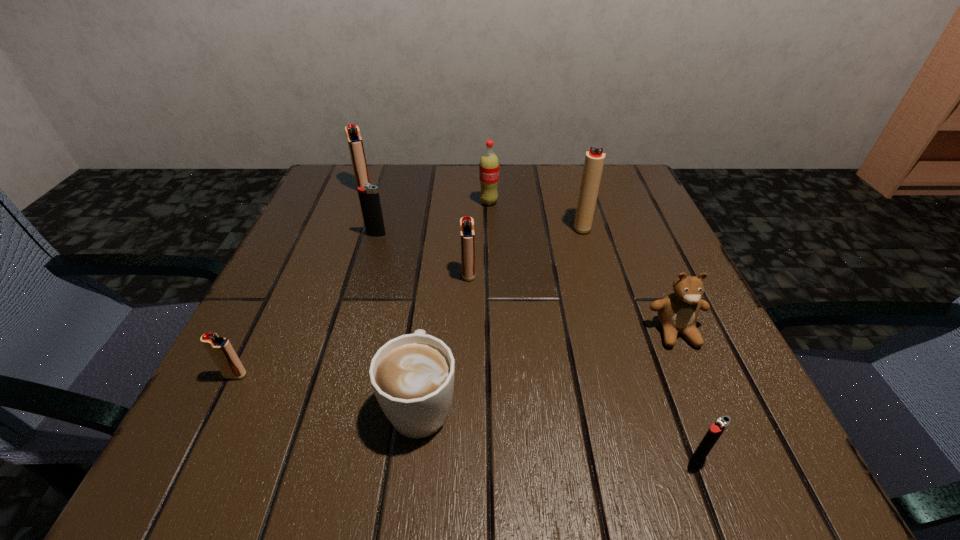
Identify the location of teddy bear at the right edge. The height and width of the screenshot is (540, 960). (678, 312).

Image resolution: width=960 pixels, height=540 pixels. In order to click on object positioned at the far left corner in this screenshot , I will do `click(355, 143)`.

The width and height of the screenshot is (960, 540). What are the coordinates of `object that is at the far right corner` in the screenshot? It's located at pos(594,160).

Locate an element on the screen. The image size is (960, 540). object that is at the near right corner is located at coordinates (x=715, y=431).

Image resolution: width=960 pixels, height=540 pixels. In the image, there is a desktop. Identify the location of vacant space at the far edge. (517, 218).

Where is `vacant space at the near edge of the desktop`? The height and width of the screenshot is (540, 960). vacant space at the near edge of the desktop is located at coordinates (592, 446).

Image resolution: width=960 pixels, height=540 pixels. Find the location of `free region at the left edge of the desktop`. free region at the left edge of the desktop is located at coordinates (255, 416).

I want to click on vacant area at the right edge of the desktop, so click(619, 246).

Image resolution: width=960 pixels, height=540 pixels. In order to click on vacant space at the far right corner of the desktop in this screenshot , I will do `click(650, 210)`.

This screenshot has height=540, width=960. In order to click on vacant space at the near right corner in this screenshot , I will do `click(761, 450)`.